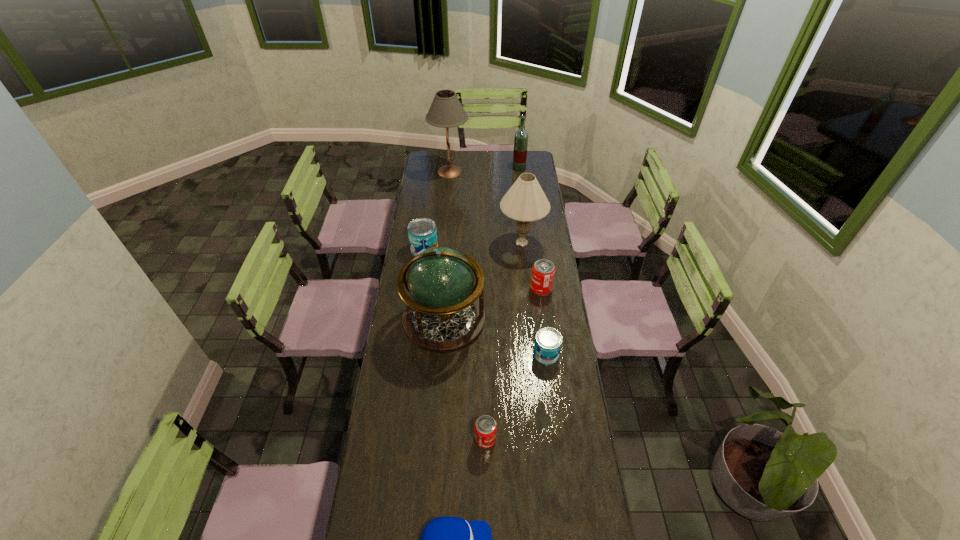
Find the location of a particular element. This screenshot has width=960, height=540. the right blue can is located at coordinates (548, 341).

The width and height of the screenshot is (960, 540). In order to click on the third farthest can in this screenshot , I will do `click(548, 341)`.

Identify the location of vacant space situated on the front-facing side of the tallest object. (484, 172).

Locate an element on the screen. free space located 0.390m on the front of the beige lampshade is located at coordinates (530, 321).

Locate an element on the screen. This screenshot has width=960, height=540. vacant space located on the front-facing side of the globe is located at coordinates (441, 373).

This screenshot has width=960, height=540. I want to click on vacant region located 0.300m on the front of the green liquor, so click(523, 201).

Identify the location of free spot located on the front of the bigger red can. The height and width of the screenshot is (540, 960). (544, 312).

Locate an element on the screen. This screenshot has width=960, height=540. vacant space located 0.080m on the right of the bigger blue can is located at coordinates (454, 249).

In order to click on free space located on the front of the smaller red can in this screenshot , I will do `click(486, 483)`.

The height and width of the screenshot is (540, 960). I want to click on blank space located 0.330m on the left of the second nearest can, so click(x=451, y=354).